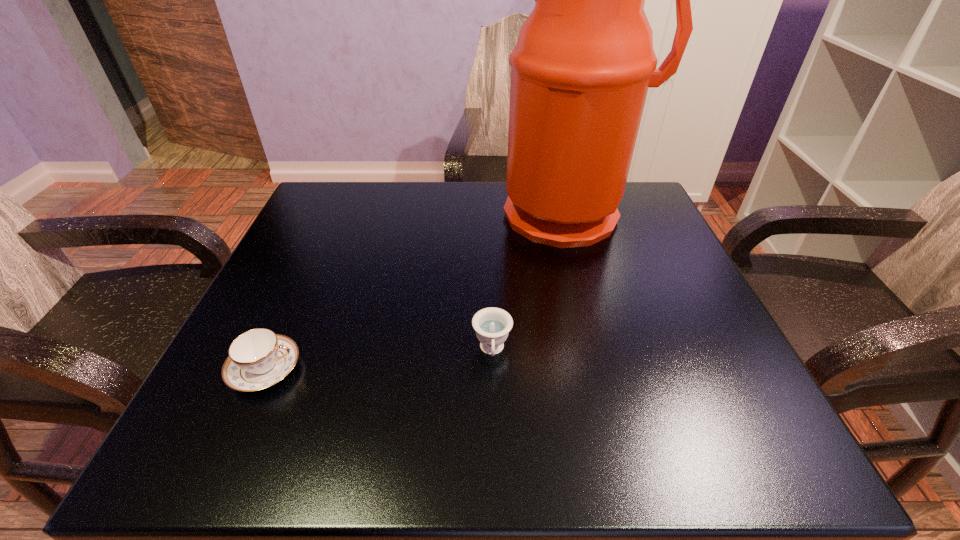
This screenshot has height=540, width=960. Identify the location of the farthest object. (584, 60).

The width and height of the screenshot is (960, 540). Identify the location of water jug. (584, 60).

Locate an element on the screen. The width and height of the screenshot is (960, 540). the right teacup is located at coordinates point(492,325).

The height and width of the screenshot is (540, 960). Identify the location of the leftmost object. [259, 358].

The image size is (960, 540). What are the coordinates of `free spot located 0.160m from the spout of the farthest object` in the screenshot? It's located at (594, 301).

At what (x,y) coordinates should I click in order to perform the action: click on free space located on the side with the handle of the left teacup. Please return your answer as a coordinate pair (x, y). This screenshot has width=960, height=540. Looking at the image, I should click on (431, 369).

Find the location of `object present at the far edge`. object present at the far edge is located at coordinates (584, 60).

Image resolution: width=960 pixels, height=540 pixels. I want to click on object positioned at the left edge, so click(259, 358).

At what (x,y) coordinates should I click in order to perform the action: click on object at the right edge. Please return your answer as a coordinate pair (x, y). Looking at the image, I should click on (584, 60).

At what (x,y) coordinates should I click in order to perform the action: click on object located in the far right corner section of the desktop. Please return your answer as a coordinate pair (x, y). Looking at the image, I should click on (584, 60).